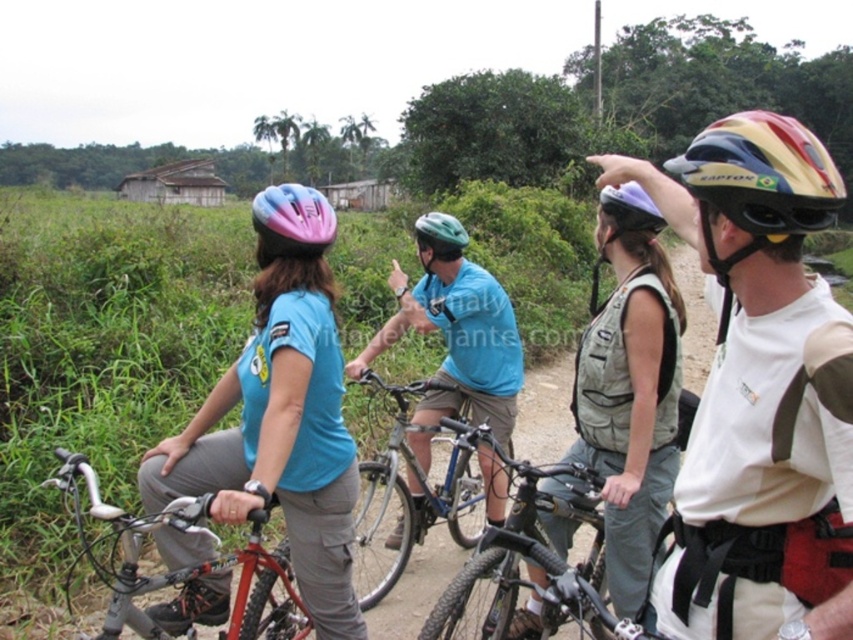
Question: Among these points, which one is nearest to the camera?

Choices:
 (A) (704, 419)
 (B) (440, 237)
 (C) (202, 541)

Answer: (A)

Question: Does matte blue helmet at center have a lesser width compared to pink matte bicycle helmet at center?

Choices:
 (A) yes
 (B) no

Answer: (A)

Question: Does matte blue shirt at center appear over multicolored matte bicycle helmet at right?

Choices:
 (A) yes
 (B) no

Answer: (B)

Question: Which point appears closest to the camera in this image?

Choices:
 (A) (689, 173)
 (B) (323, 289)
 (C) (426, 396)
 (D) (714, 365)

Answer: (A)

Question: Which object is the closest to the red matte bicycle at left?

Choices:
 (A) multicolored matte bicycle helmet at right
 (B) green matte bicycle helmet at center

Answer: (A)

Question: Is multicolored matte bicycle helmet at right below pink matte bicycle helmet at center?

Choices:
 (A) no
 (B) yes

Answer: (B)